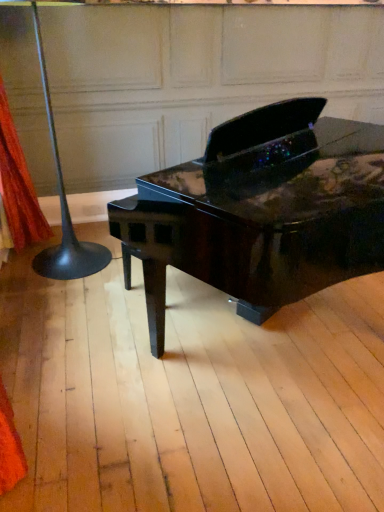
Question: In the image, is glossy black piano at center positioned in front of or behind black glossy floor lamp at left?

Choices:
 (A) front
 (B) behind

Answer: (A)

Question: Based on their positions, is glossy black piano at center located to the left or right of black glossy floor lamp at left?

Choices:
 (A) left
 (B) right

Answer: (B)

Question: Estimate the real-world distances between objects in this image. Which object is closer to the glossy black piano at center?

Choices:
 (A) orange fabric at left
 (B) black glossy floor lamp at left

Answer: (B)

Question: Which object is the farthest from the orange fabric at left?

Choices:
 (A) glossy black piano at center
 (B) black glossy floor lamp at left

Answer: (A)